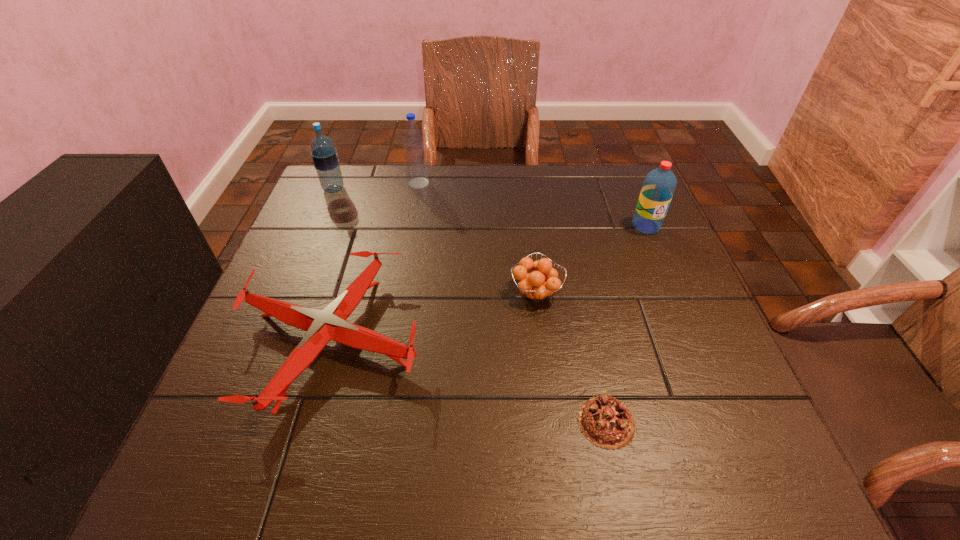
Locate an element on the screen. free space between the leftmost water bottle and the drone is located at coordinates (333, 264).

Where is `free space between the rightmost water bottle and the second water bottle from left to right`? free space between the rightmost water bottle and the second water bottle from left to right is located at coordinates coord(532,205).

I want to click on vacant region between the drone and the leftmost water bottle, so click(333, 264).

You are a GUI agent. You are given a task and a screenshot of the screen. Output one action in this format:
    pyautogui.click(x=<x>, y=<y>)
    Task: Click on the free spot between the drone and the chocolate cake
    The width and height of the screenshot is (960, 540).
    Given the screenshot: What is the action you would take?
    pyautogui.click(x=469, y=381)

What are the coordinates of `object that is the closest to the drone` in the screenshot? It's located at (533, 285).

Locate which object ranks in proximity to the leftmost water bottle. Please provide its 2D coordinates. Your answer should be formatted as a tuple, i.e. [(x, y)], where the tuple contains the x and y coordinates of a point satisfying the conditions above.

[(415, 159)]

Image resolution: width=960 pixels, height=540 pixels. What are the coordinates of `the third closest water bottle to the drone` in the screenshot? It's located at (659, 185).

Locate which water bottle is the closest to the second water bottle from left to right. Please provide its 2D coordinates. Your answer should be formatted as a tuple, i.e. [(x, y)], where the tuple contains the x and y coordinates of a point satisfying the conditions above.

[(324, 155)]